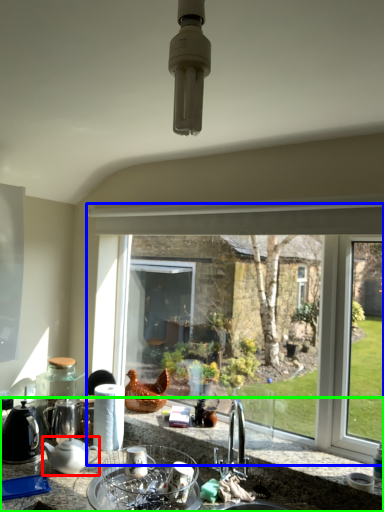
Question: Which object is positioned closest to kitchen appliance (highlighted by a red box)? Select from window (highlighted by a blue box) and countertop (highlighted by a green box).

Choices:
 (A) window
 (B) countertop

Answer: (B)